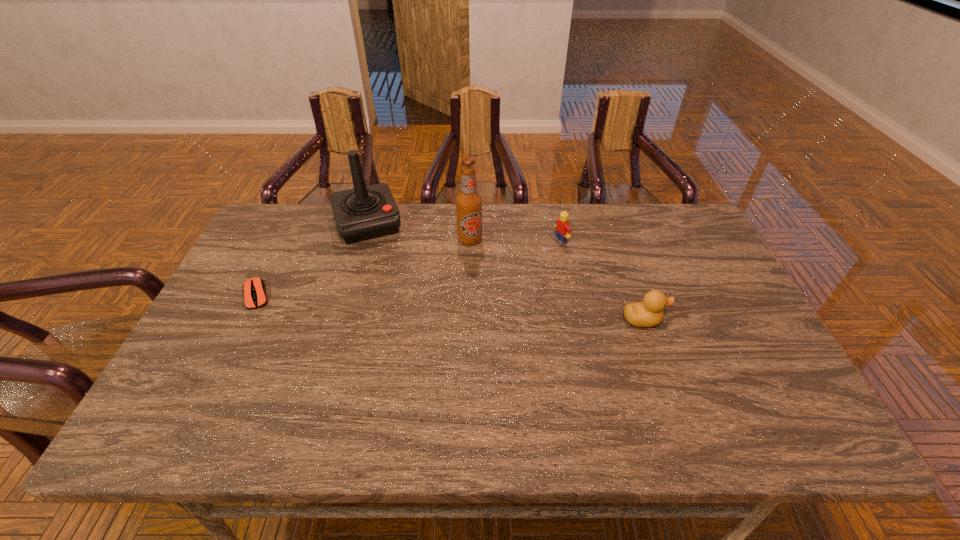
Locate an element on the screen. vacant space that satisfies the following two spatial constraints: 1. on the front side of the Lego; 2. on the face of the rightmost object is located at coordinates (577, 320).

The width and height of the screenshot is (960, 540). I want to click on vacant position in the image that satisfies the following two spatial constraints: 1. on the back side of the computer mouse; 2. on the right side of the Lego, so (x=284, y=241).